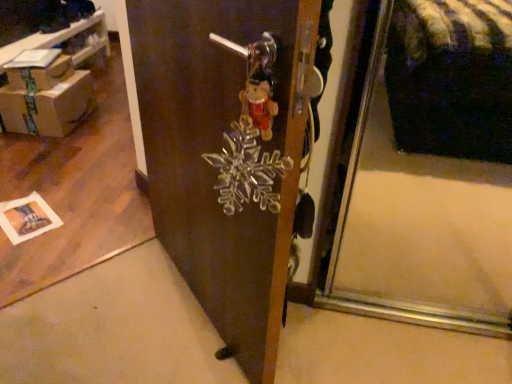
Question: Looking at the image, does cardboard box at left seem bigger or smaller compared to transparent glass snowflake at center?

Choices:
 (A) big
 (B) small

Answer: (B)

Question: In the image, is cardboard box at left positioned in front of or behind transparent glass snowflake at center?

Choices:
 (A) front
 (B) behind

Answer: (B)

Question: Which object is positioned farthest from the transparent glass snowflake at center?

Choices:
 (A) brown cardboard boxes at left
 (B) brown cardboard box at upper left
 (C) cardboard box at left

Answer: (A)

Question: Which object is positioned farthest from the brown cardboard boxes at left?

Choices:
 (A) transparent glass snowflake at center
 (B) brown cardboard box at upper left
 (C) cardboard box at left

Answer: (A)